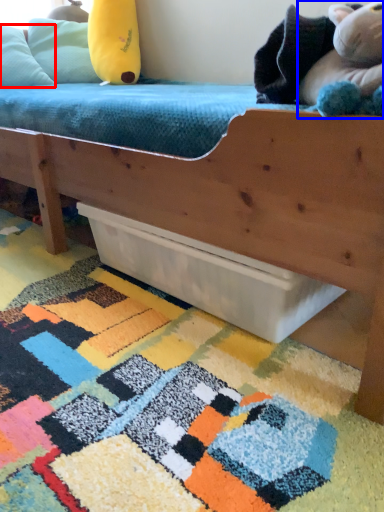
Question: Which object appears farthest to the camera in this image, pillow (highlighted by a red box) or toy (highlighted by a blue box)?

Choices:
 (A) pillow
 (B) toy

Answer: (A)